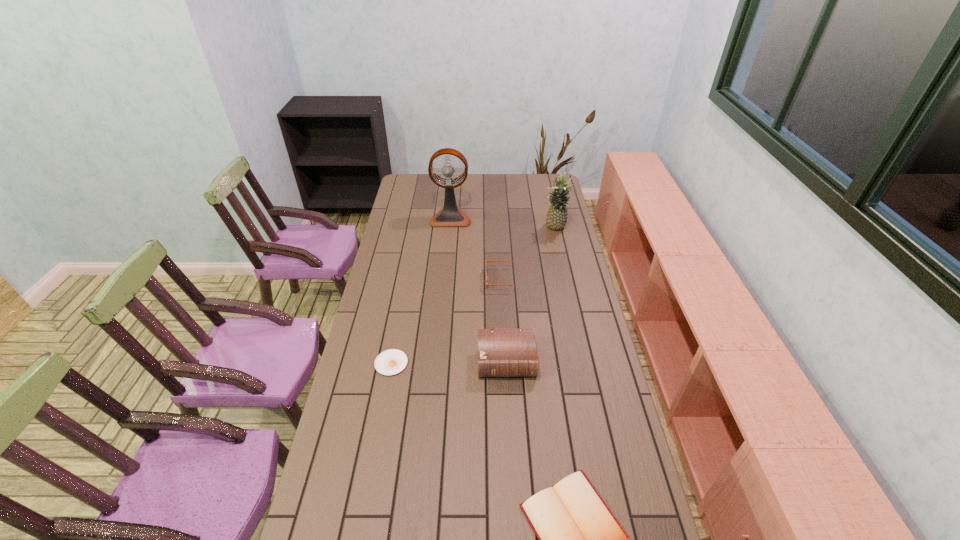
I want to click on vacant region located on the front of the pineapple, so click(x=563, y=263).

The width and height of the screenshot is (960, 540). What are the coordinates of `blank space located on the spine side of the taller Bible` in the screenshot? It's located at (509, 406).

At what (x,y) coordinates should I click in order to perform the action: click on free space located on the front-facing side of the sunglasses. Please return your answer as a coordinate pair (x, y). This screenshot has height=540, width=960. Looking at the image, I should click on (438, 279).

Identify the location of vacant region located on the front-facing side of the sunglasses. The height and width of the screenshot is (540, 960). (436, 279).

I want to click on vacant space located on the front-facing side of the sunglasses, so pyautogui.click(x=433, y=279).

Locate an element on the screen. The width and height of the screenshot is (960, 540). vacant space located 0.190m on the back of the leftmost object is located at coordinates 400,314.

Find the location of a particular element. object present at the left edge is located at coordinates (390, 362).

Locate an element on the screen. object that is positioned at the right edge is located at coordinates tap(556, 218).

Where is `vacant region at the far edge of the desktop`? vacant region at the far edge of the desktop is located at coordinates (460, 173).

The height and width of the screenshot is (540, 960). In the image, there is a desktop. Find the location of `vacant space at the left edge`. vacant space at the left edge is located at coordinates (404, 246).